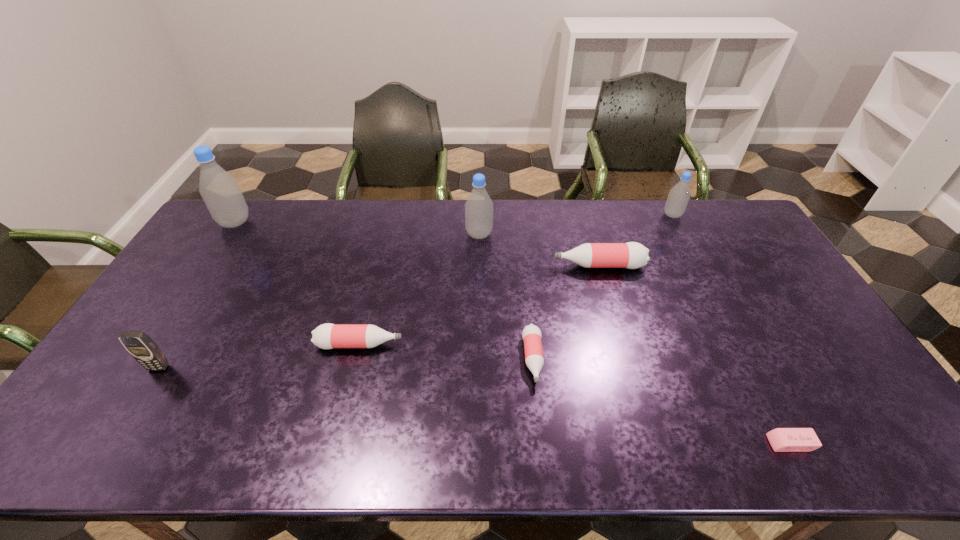
Locate an element on the screen. the fifth tallest bottle is located at coordinates (326, 336).

Where is `the fourth object from right to left`? This screenshot has width=960, height=540. the fourth object from right to left is located at coordinates (531, 334).

The width and height of the screenshot is (960, 540). I want to click on the smallest pink bottle, so click(x=531, y=334).

The width and height of the screenshot is (960, 540). I want to click on the shortest object, so point(781,439).

What are the coordinates of `pink eraser` in the screenshot? It's located at pyautogui.click(x=781, y=439).

You are a GUI agent. You are given a task and a screenshot of the screen. Output one action in this format:
    pyautogui.click(x=<x>, y=<y>)
    Task: Click on the vacant space situated 0.320m on the right of the leftmost gray bottle
    The width and height of the screenshot is (960, 540).
    Given the screenshot: What is the action you would take?
    pyautogui.click(x=339, y=222)

Where is `free space located on the right of the second tallest object`? free space located on the right of the second tallest object is located at coordinates (549, 234).

At what (x,y) coordinates should I click in order to perform the action: click on free space located on the right of the sixth shortest object. Please return your answer as a coordinate pair (x, y). The height and width of the screenshot is (540, 960). Looking at the image, I should click on (704, 215).

I want to click on free space located on the front face of the cellular telephone, so click(x=134, y=407).

The width and height of the screenshot is (960, 540). Identify the location of free space located 0.200m with the cap open on the rightmost pink bottle. (492, 266).